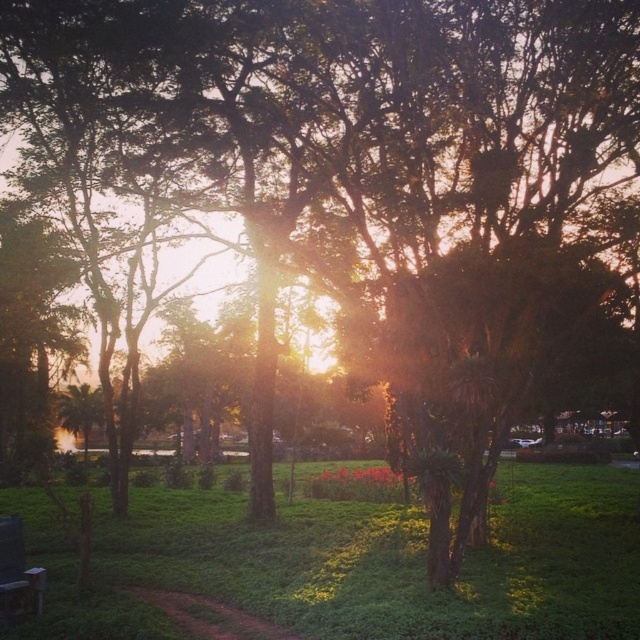
Does green grassy at center appear under wooden park bench at lower left?

Yes, green grassy at center is below wooden park bench at lower left.

Find the location of `green grassy at center`. green grassy at center is located at coordinates (396, 561).

Where is `green grassy at center`? green grassy at center is located at coordinates (396, 561).